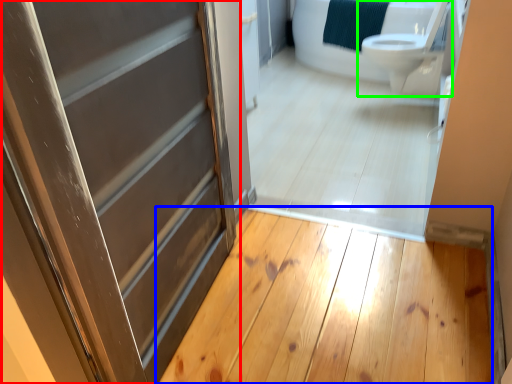
Question: Which object is positioned closest to door (highlighted by a red box)? Select from plank (highlighted by a blue box) and toilet (highlighted by a green box).

Choices:
 (A) plank
 (B) toilet

Answer: (A)